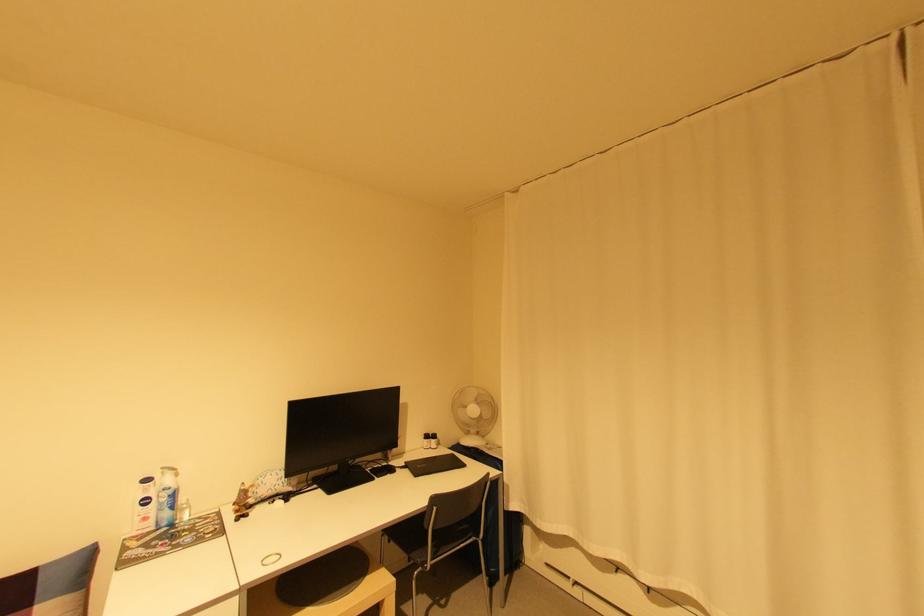
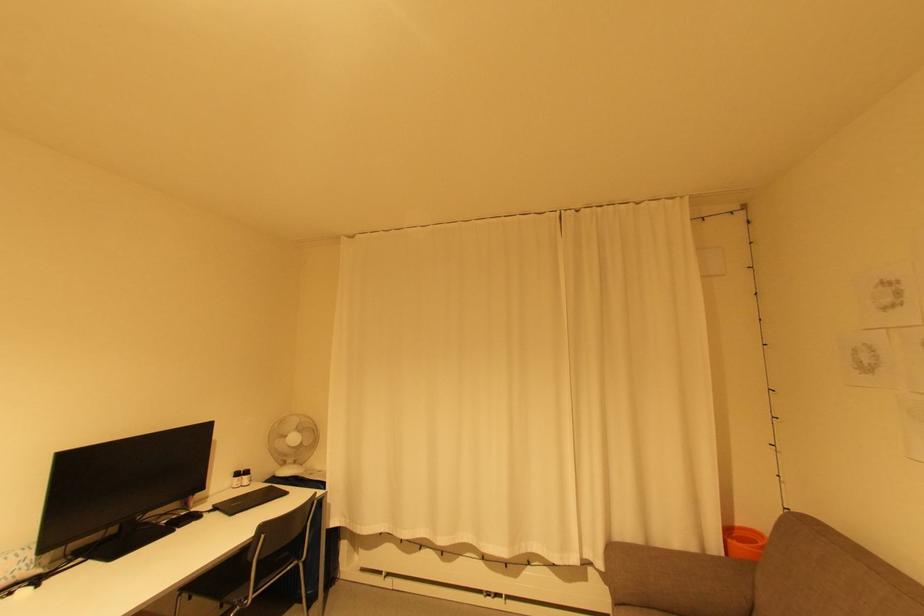
Find the pixel in the second image that matches point (438, 440) in the first image.

(250, 477)